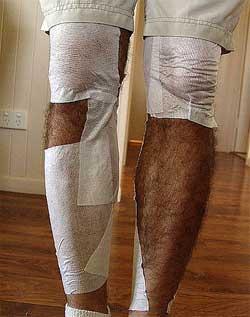
I want to click on outlet, so click(6, 123), click(20, 121).